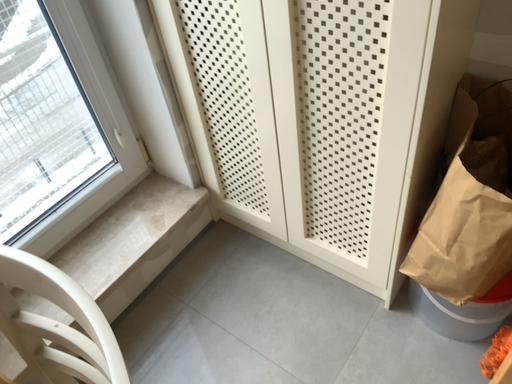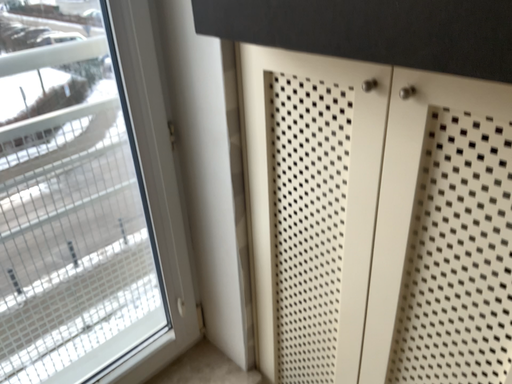
Question: How did the camera likely rotate when shooting the video?

Choices:
 (A) rotated downward
 (B) rotated upward

Answer: (B)